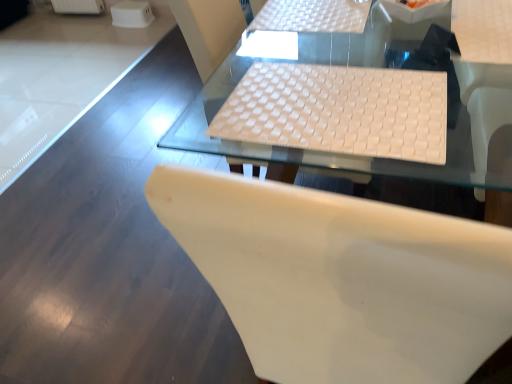
Question: Is white woven mat at upper center, which is counted as the first table, starting from the top, aimed at white matte chair at center?

Choices:
 (A) no
 (B) yes

Answer: (B)

Question: Is white woven mat at upper center, which is counted as the second table, starting from the bottom, taller than white matte chair at center?

Choices:
 (A) no
 (B) yes

Answer: (A)

Question: Can you confirm if white woven mat at upper center, which is counted as the second table, starting from the bottom, is smaller than white matte chair at center?

Choices:
 (A) no
 (B) yes

Answer: (B)

Question: Is white woven mat at upper center, which is counted as the second table, starting from the bottom, in front of white matte chair at center?

Choices:
 (A) yes
 (B) no

Answer: (B)

Question: From the image's perspective, is white woven mat at upper center, which is counted as the second table, starting from the bottom, under white matte chair at center?

Choices:
 (A) yes
 (B) no

Answer: (B)

Question: From the image's perspective, is white woven mat at center, which is counted as the first table, starting from the bottom, above or below white woven fabric laptop keyboard at center?

Choices:
 (A) above
 (B) below

Answer: (A)

Question: Is white woven mat at center, which is counted as the first table, starting from the bottom, situated inside white woven fabric laptop keyboard at center or outside?

Choices:
 (A) outside
 (B) inside

Answer: (A)

Question: From their relative heights in the image, would you say white woven mat at center, which is counted as the first table, starting from the bottom, is taller or shorter than white woven fabric laptop keyboard at center?

Choices:
 (A) tall
 (B) short

Answer: (A)

Question: Looking at their shapes, would you say white woven mat at center, the second table in the top-to-bottom sequence, is wider or thinner than white woven fabric laptop keyboard at center?

Choices:
 (A) wide
 (B) thin

Answer: (A)

Question: Considering the positions of white woven mat at upper center, which is counted as the second table, starting from the bottom, and white woven fabric laptop keyboard at center in the image, is white woven mat at upper center, which is counted as the second table, starting from the bottom, taller or shorter than white woven fabric laptop keyboard at center?

Choices:
 (A) short
 (B) tall

Answer: (B)

Question: Is point (332, 8) positioned closer to the camera than point (276, 79)?

Choices:
 (A) farther
 (B) closer

Answer: (A)

Question: From the image's perspective, is white woven mat at upper center, which is counted as the second table, starting from the bottom, located above or below white woven fabric laptop keyboard at center?

Choices:
 (A) above
 (B) below

Answer: (A)

Question: Looking at the image, does white woven mat at upper center, which is counted as the second table, starting from the bottom, seem bigger or smaller compared to white woven fabric laptop keyboard at center?

Choices:
 (A) big
 (B) small

Answer: (B)

Question: From a real-world perspective, is white matte chair at center positioned above or below white woven mat at center, the second table in the top-to-bottom sequence?

Choices:
 (A) above
 (B) below

Answer: (B)

Question: From the image's perspective, is white matte chair at center above or below white woven mat at center, which is counted as the first table, starting from the bottom?

Choices:
 (A) above
 (B) below

Answer: (A)